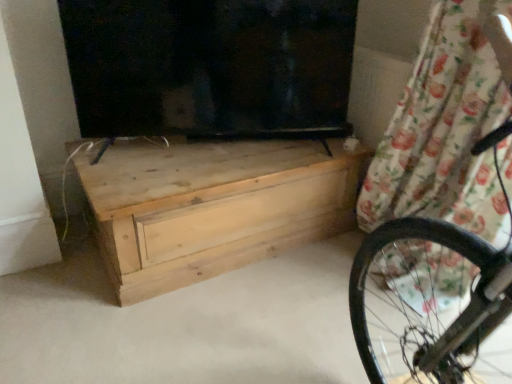
Identify the location of vacant area to the left of floral fabric curtain at upper right. (312, 284).